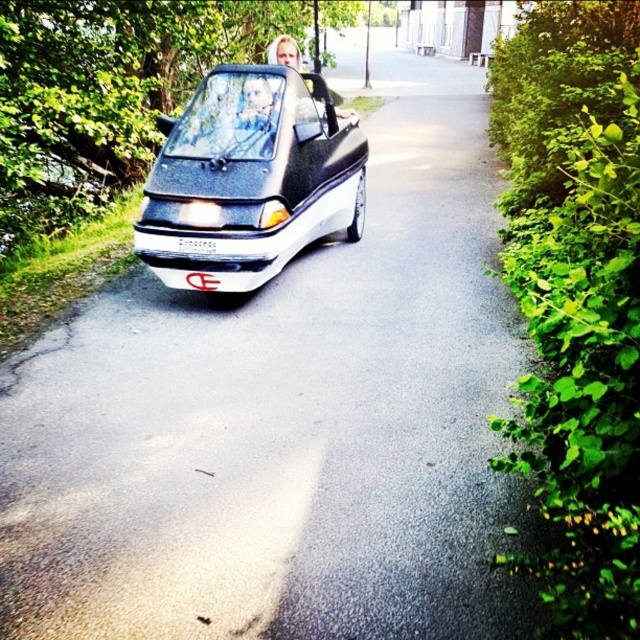
Who is more forward, (260, 145) or (289, 36)?

Point (260, 145) is more forward.

Does shiny black car at center appear under blonde hair at center?

Indeed, shiny black car at center is positioned under blonde hair at center.

Find the location of a particular element. This screenshot has height=640, width=640. shiny black car at center is located at coordinates (250, 179).

Locate an element on the screen. shiny black car at center is located at coordinates (250, 179).

Between blonde hair at center and white plastic license plate at center, which one is positioned lower?

white plastic license plate at center

Describe the element at coordinates (284, 51) in the screenshot. The image size is (640, 640). I see `blonde hair at center` at that location.

Where is `blonde hair at center`? blonde hair at center is located at coordinates (284, 51).

Can you confirm if shiny black car at center is wider than white plastic license plate at center?

Yes, shiny black car at center is wider than white plastic license plate at center.

Does shiny black car at center have a lesser width compared to white plastic license plate at center?

No, shiny black car at center is not thinner than white plastic license plate at center.

Between point (346, 154) and point (216, 241), which one is positioned behind?

Positioned behind is point (346, 154).

Identify the location of shiny black car at center. (250, 179).